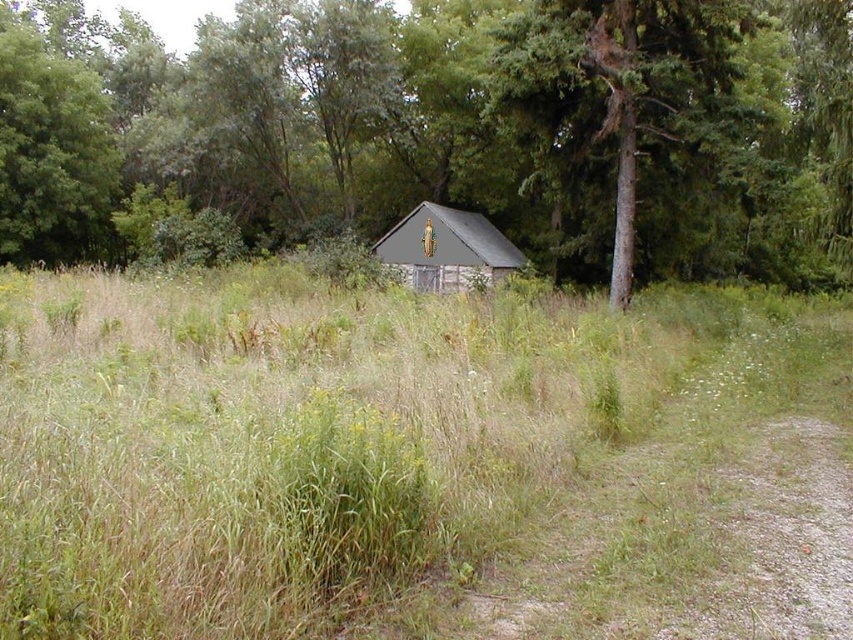
Does green grassy at center have a smaller size compared to brown wood tree at center?

Yes, green grassy at center is smaller than brown wood tree at center.

Describe the element at coordinates (349, 438) in the screenshot. The width and height of the screenshot is (853, 640). I see `green grassy at center` at that location.

Is point (469, 330) closer to camera compared to point (763, 196)?

Yes, point (469, 330) is in front of point (763, 196).

At what (x,y) coordinates should I click in order to perform the action: click on green grassy at center. Please return your answer as a coordinate pair (x, y). This screenshot has width=853, height=640. Looking at the image, I should click on (349, 438).